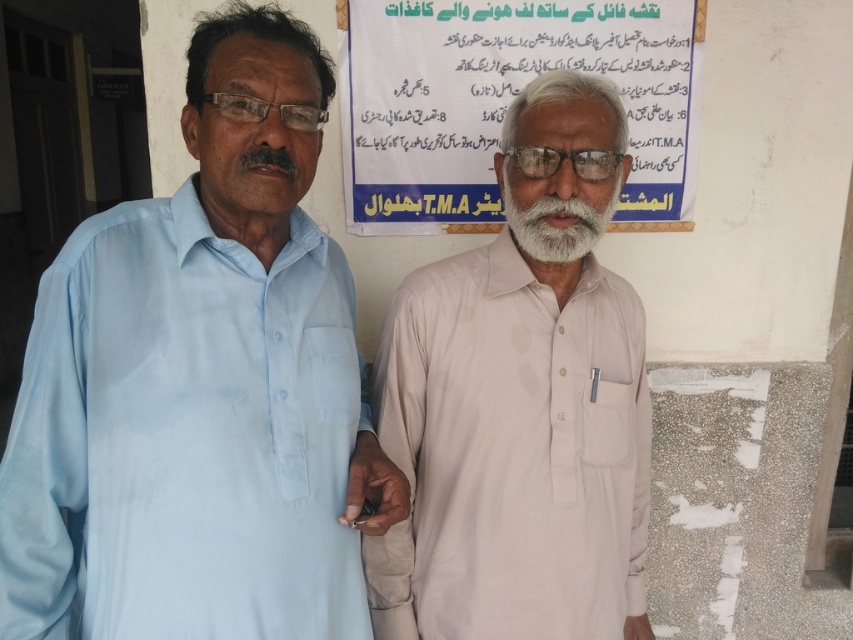
Based on the scene description, can you determine which object is taller between the white paper at upper center and the white soft beard at center?

The white paper at upper center is much taller than the white soft beard at center.

You are standing in front of the poster with the T.M.A. banner. Where exactly is the light blue cotton shirt at left located in relation to the poster?

The light blue cotton shirt at left is located at point (201, 385) in relation to the poster.